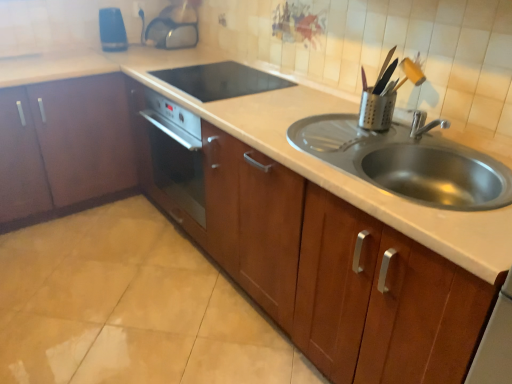
Identify the location of free space in front of blue plastic toaster at upper left, which ranks as the fourth appliance in right-to-left order. click(121, 54).